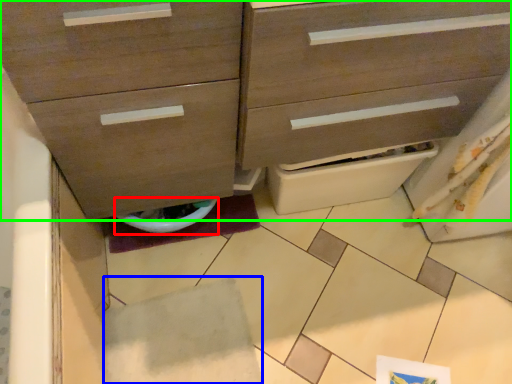
Question: Considering the real-world distances, which object is farthest from toilet bowl (highlighted by a red box)? tile (highlighted by a blue box) or chest of drawers (highlighted by a green box)?

Choices:
 (A) tile
 (B) chest of drawers

Answer: (B)